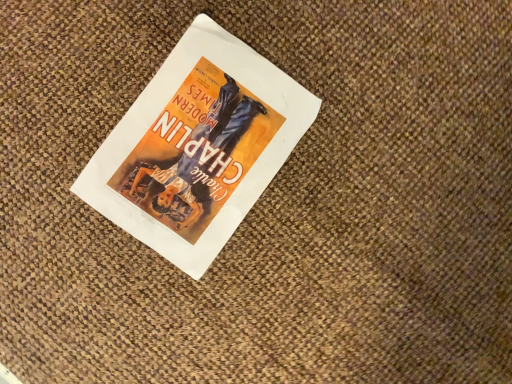
The width and height of the screenshot is (512, 384). I want to click on free spot above white paper poster at center (from a real-world perspective), so click(191, 151).